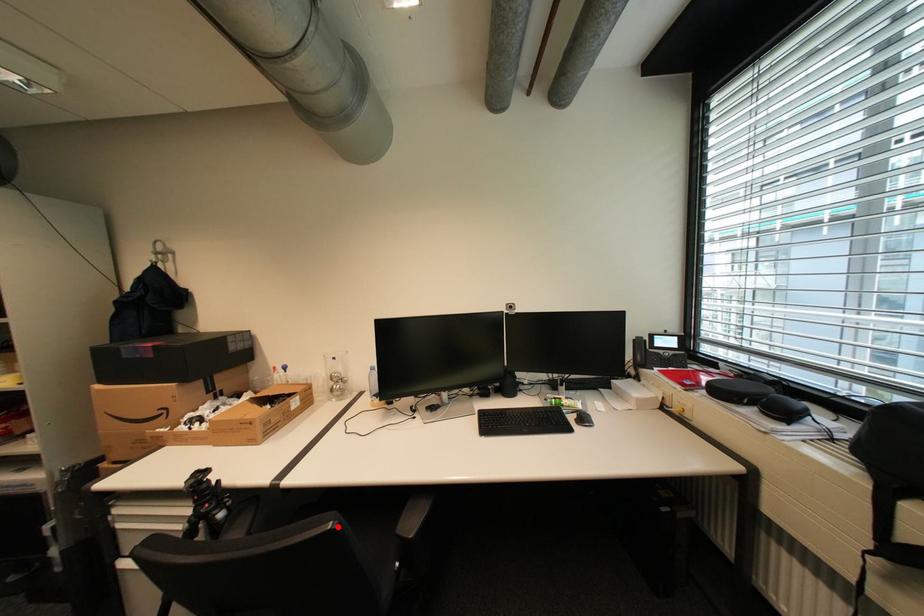
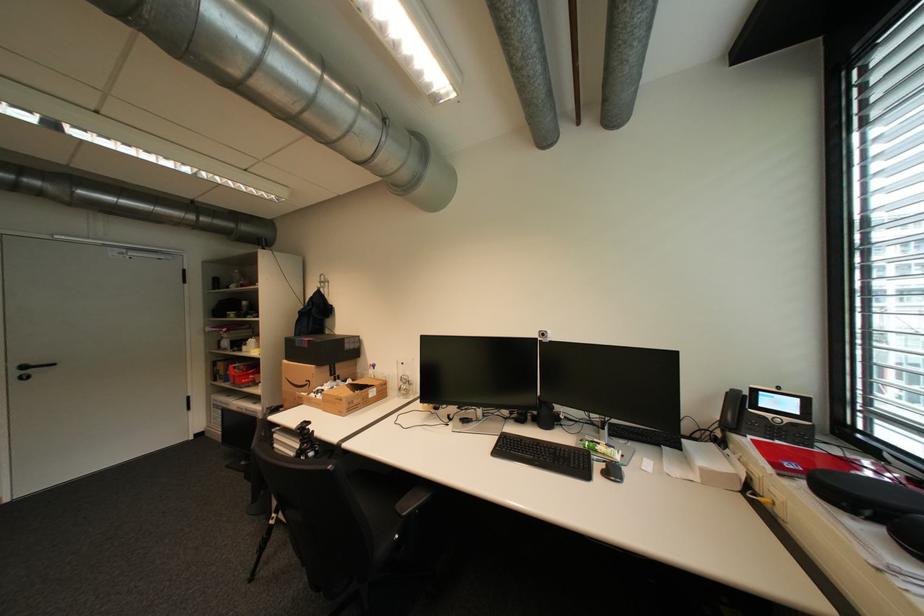
Question: I am providing you with two images of the same scene from different viewpoints. A red point is shown in image1. For the corresponding object point in image2, is it positioned nearer or farther from the camera?

Choices:
 (A) Nearer
 (B) Farther

Answer: (A)